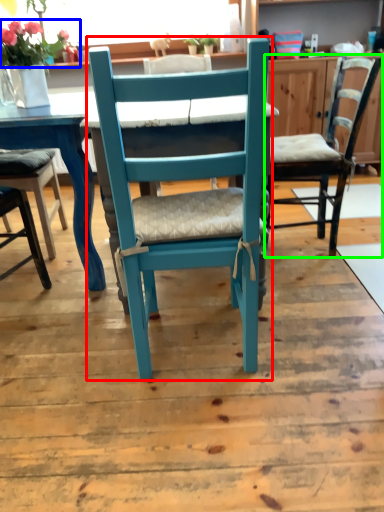
Question: Based on their relative distances, which object is nearer to chair (highlighted by a red box)? Choose from flower (highlighted by a blue box) and chair (highlighted by a green box).

Choices:
 (A) flower
 (B) chair

Answer: (B)